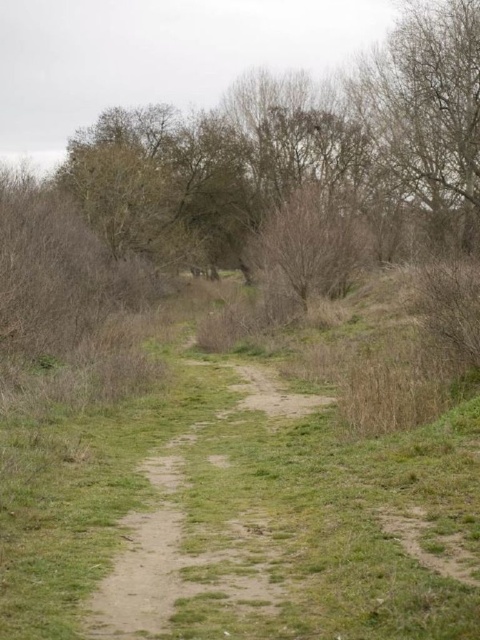
Which is in front, point (207, 554) or point (130, 544)?

Point (207, 554) is in front.

This screenshot has height=640, width=480. Describe the element at coordinates (240, 515) in the screenshot. I see `green grassy at center` at that location.

Between point (235, 540) and point (160, 595), which one is positioned behind?

The point (235, 540) is behind.

Locate an element on the screen. The image size is (480, 640). green grassy at center is located at coordinates (240, 515).